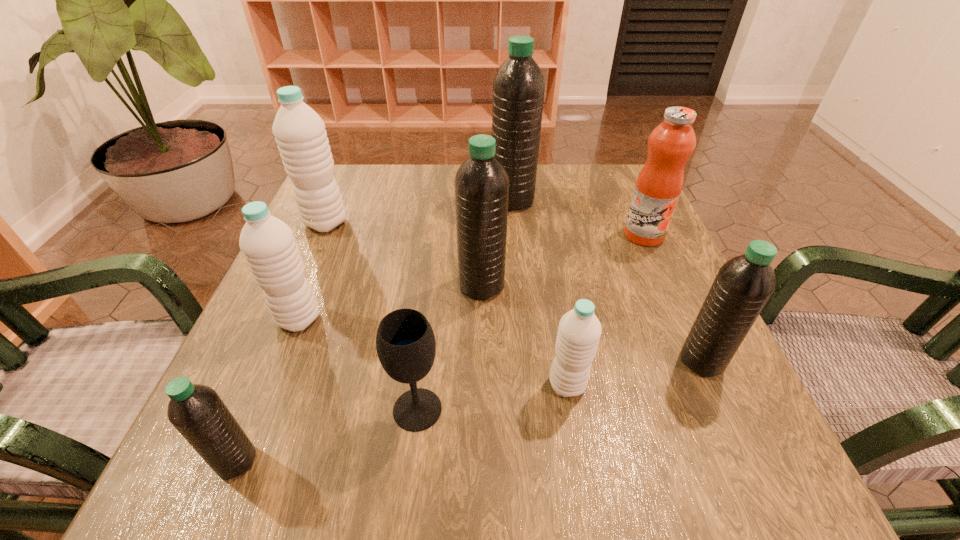
This screenshot has width=960, height=540. I want to click on the fourth object from left to right, so click(405, 342).

What are the coordinates of `the nearest water bottle` in the screenshot? It's located at (198, 413).

Locate an element on the screen. Image resolution: width=960 pixels, height=540 pixels. the smallest black water bottle is located at coordinates (198, 413).

Find the location of `the rightmost white water bottle`. the rightmost white water bottle is located at coordinates (579, 330).

Locate an element on the screen. The image size is (960, 540). the nearest white water bottle is located at coordinates (579, 330).

Locate an element on the screen. vacant space located on the left of the farthest black water bottle is located at coordinates (442, 200).

Where is `free space located 0.200m on the back of the biggest white water bottle`? free space located 0.200m on the back of the biggest white water bottle is located at coordinates (349, 168).

At what (x,y) coordinates should I click in order to perform the action: click on free location located 0.250m on the left of the fourth farthest object. Please return your answer as a coordinate pair (x, y). Image resolution: width=960 pixels, height=540 pixels. Looking at the image, I should click on (330, 285).

Find the location of a particular element. vacant region located on the front label of the fruit juice is located at coordinates (699, 359).

You are a GUI agent. You are given a task and a screenshot of the screen. Output one action in this format:
    pyautogui.click(x=<x>, y=<y>)
    Task: Click on the free space located 0.220m on the back of the fourth farthest water bottle
    
    Given the screenshot: What is the action you would take?
    coord(334,232)